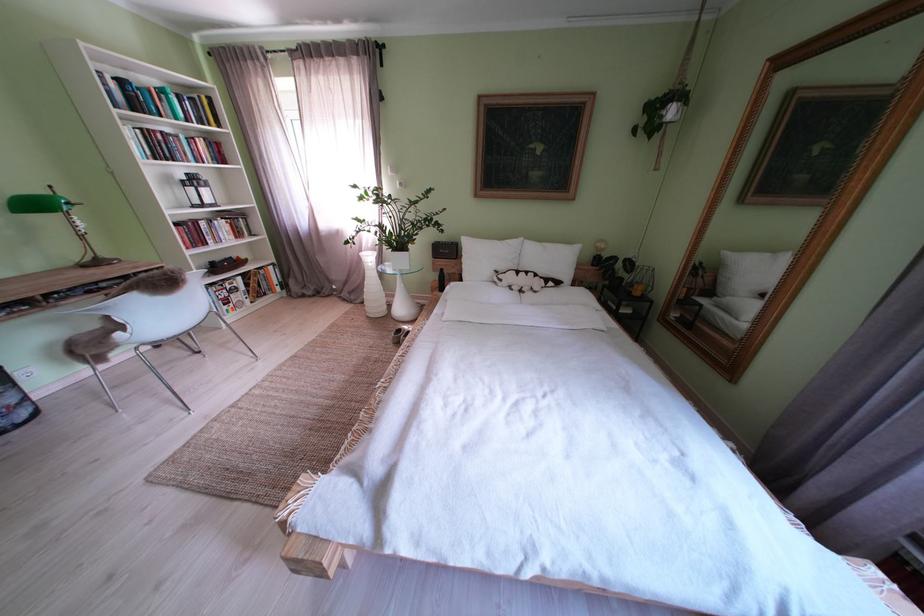
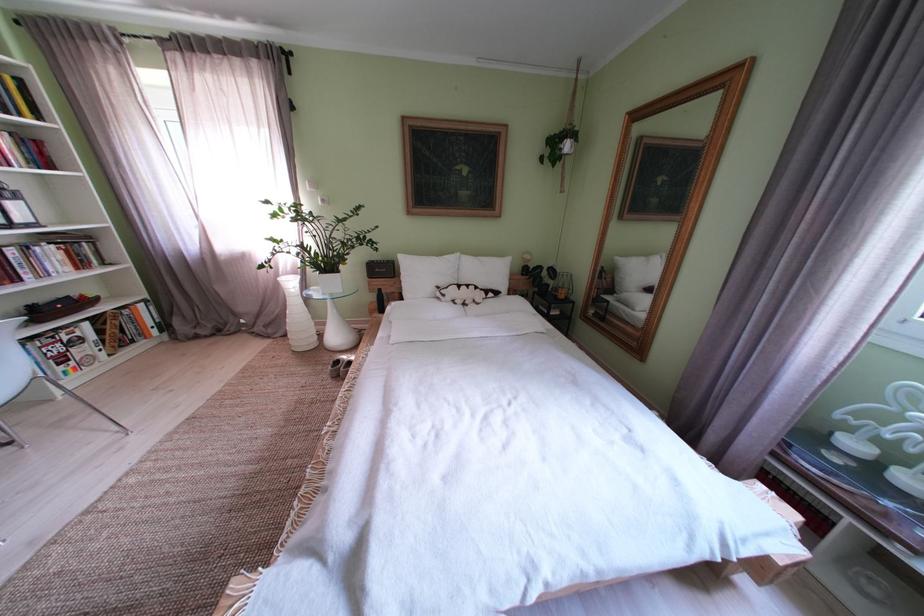
The point at (378,302) is marked in the first image. Where is the corresponding point in the second image?

(301, 334)